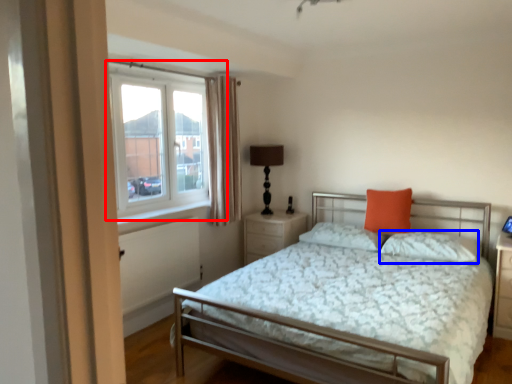
Question: Which object appears closest to the camera in this image, window (highlighted by a red box) or pillow (highlighted by a blue box)?

Choices:
 (A) window
 (B) pillow

Answer: (A)